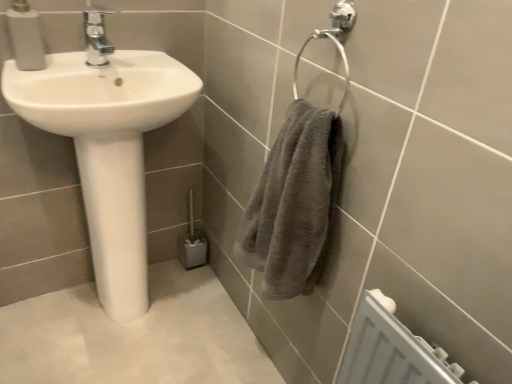
The height and width of the screenshot is (384, 512). I want to click on free point behind chrome metallic faucet at upper center, so pyautogui.click(x=133, y=54).